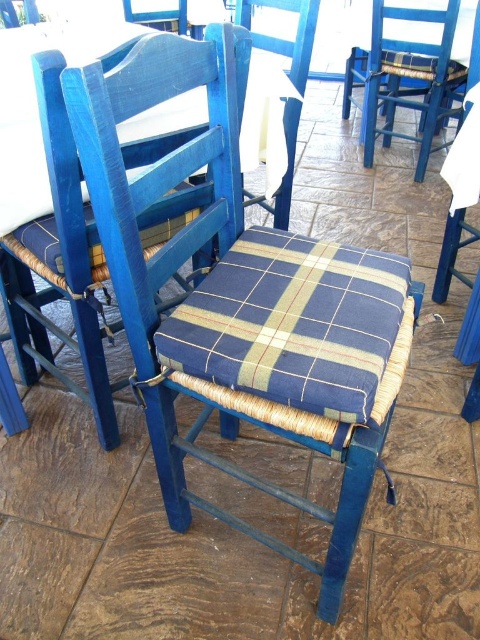
Question: Observing the image, what is the correct spatial positioning of matte blue wood chair at center in reference to blue woven chair at upper right?

Choices:
 (A) below
 (B) above

Answer: (A)

Question: Which point is closer to the camera?

Choices:
 (A) blue woven wicker chair at center
 (B) matte blue wood chair at center

Answer: (B)

Question: Which of the following is the closest to the observer?

Choices:
 (A) blue woven wicker chair at center
 (B) blue plaid cushion at center

Answer: (B)

Question: Where is blue plaid cushion at center located in relation to blue woven chair at upper right in the image?

Choices:
 (A) right
 (B) left

Answer: (B)

Question: Estimate the real-world distances between objects in this image. Which object is farther from the matte blue wood chair at center?

Choices:
 (A) blue plaid cushion at center
 (B) blue woven wicker chair at center

Answer: (B)

Question: Can you confirm if blue woven chair at upper right is positioned to the left of blue woven wicker chair at center?

Choices:
 (A) yes
 (B) no

Answer: (B)